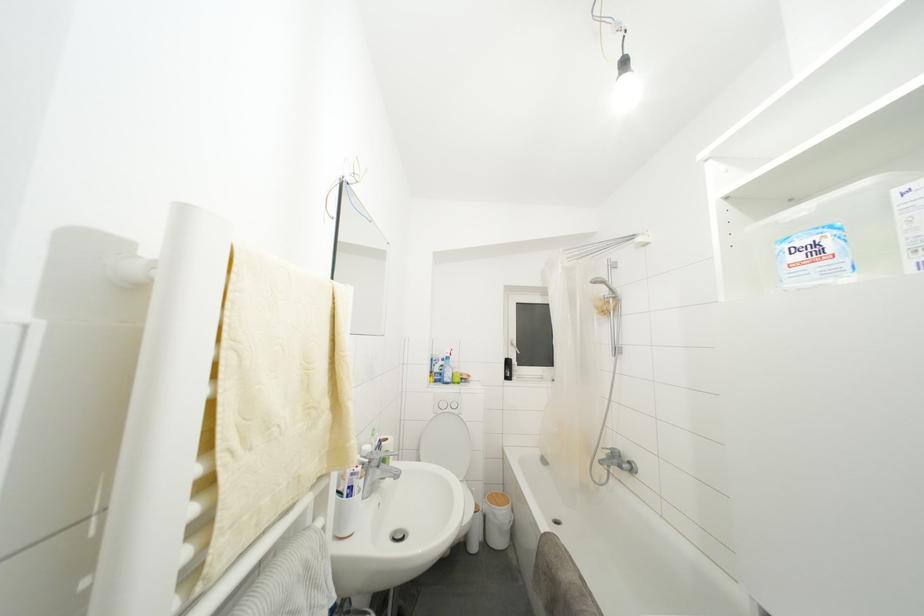
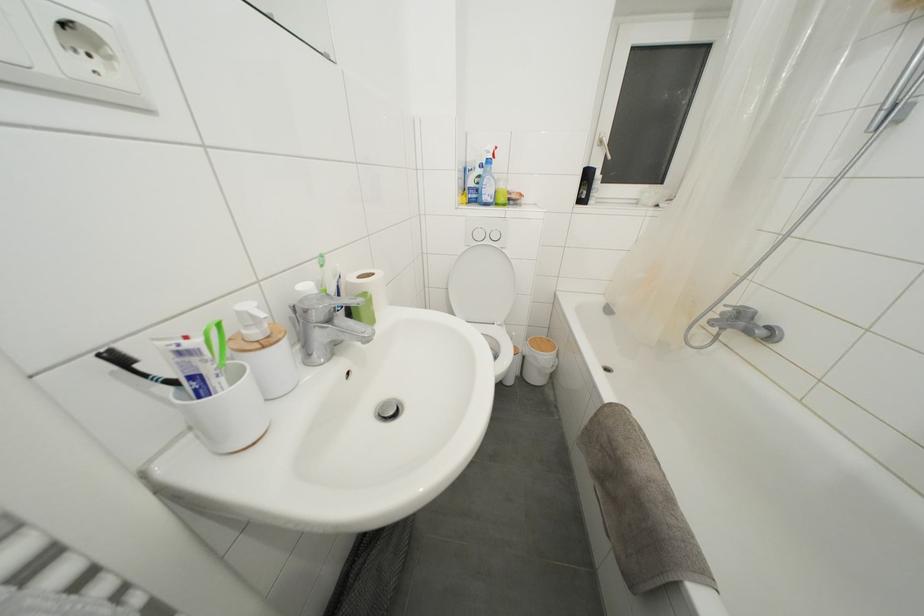
Locate, in the second image, the point that corresponds to (x=513, y=368) in the first image.

(591, 180)